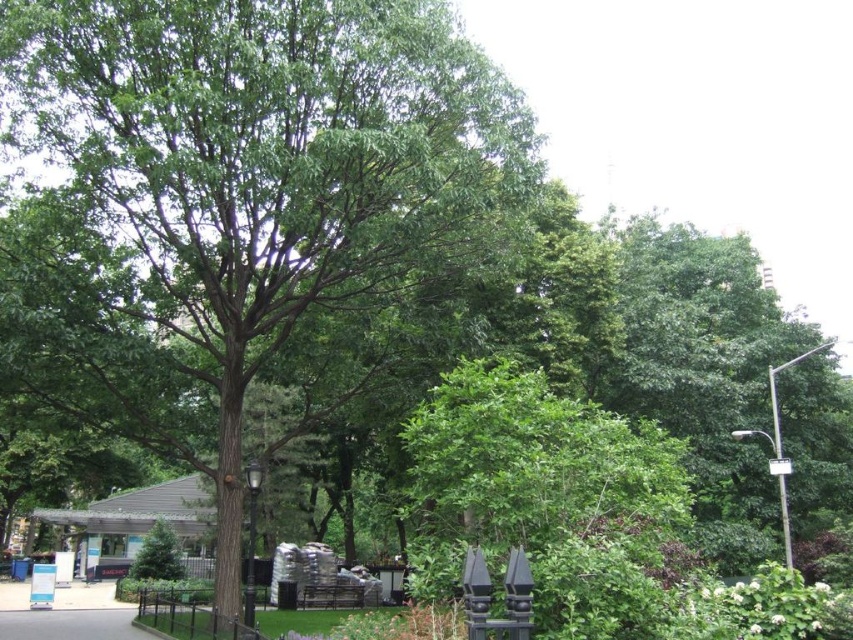
Question: Based on their relative distances, which object is nearer to the black metal fence at lower left?

Choices:
 (A) green leafy tree at center
 (B) gray asphalt pavement at lower left

Answer: (B)

Question: Is green leafy tree at center thinner than black metal fence at lower left?

Choices:
 (A) yes
 (B) no

Answer: (B)

Question: Is green leafy tree at center to the right of gray asphalt pavement at lower left from the viewer's perspective?

Choices:
 (A) yes
 (B) no

Answer: (A)

Question: Is green leafy tree at center wider than black metal fence at lower left?

Choices:
 (A) no
 (B) yes

Answer: (B)

Question: Which of the following is the farthest from the observer?

Choices:
 (A) green leafy tree at center
 (B) gray asphalt pavement at lower left

Answer: (B)

Question: Which of these objects is positioned closest to the green leafy tree at center?

Choices:
 (A) black metal fence at lower left
 (B) gray asphalt pavement at lower left

Answer: (A)